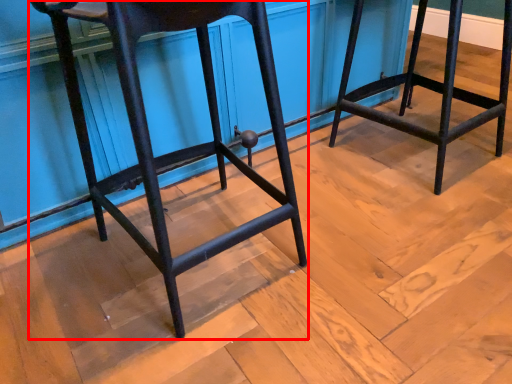
Question: From the image's perspective, where is furniture (annotated by the red box) located in relation to furniture in the image?

Choices:
 (A) below
 (B) above

Answer: (A)